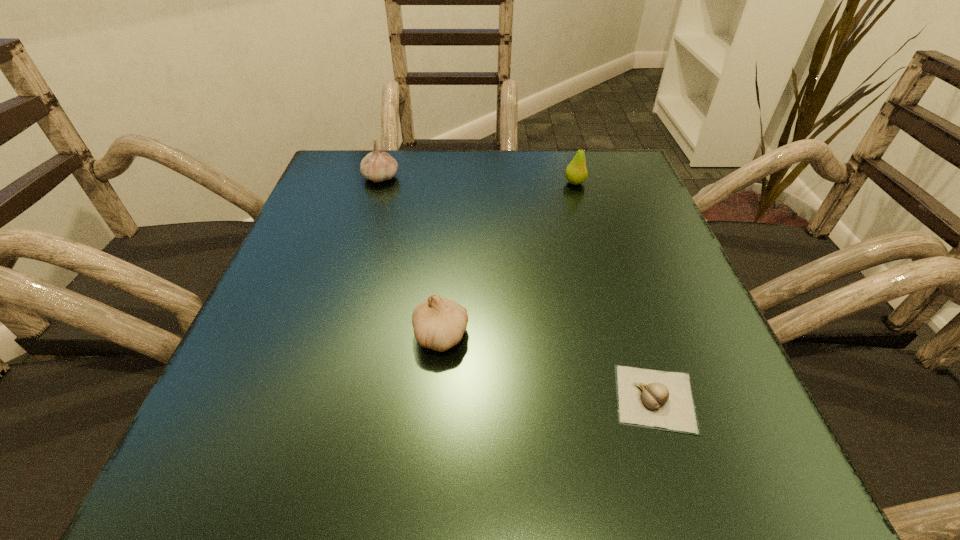
Locate an element on the screen. The image size is (960, 540). empty space that is in between the third tallest object and the leftmost garlic is located at coordinates (411, 256).

Where is `vacant space that's between the pear and the third tallest object`? The image size is (960, 540). vacant space that's between the pear and the third tallest object is located at coordinates (508, 259).

Identify the location of blank region between the pear and the farthest garlic. (478, 180).

Where is `vacant space that is in between the tallest garlic and the pear`? Image resolution: width=960 pixels, height=540 pixels. vacant space that is in between the tallest garlic and the pear is located at coordinates (478, 180).

You are a GUI agent. You are given a task and a screenshot of the screen. Output one action in this format:
    pyautogui.click(x=<x>, y=<y>)
    Task: Click on the vacant point located between the second nearest garlic and the pear
    This screenshot has height=540, width=960.
    Given the screenshot: What is the action you would take?
    pyautogui.click(x=508, y=259)

Where is `vacant space that's between the tallest garlic and the pear`? vacant space that's between the tallest garlic and the pear is located at coordinates (478, 180).

Locate an element on the screen. The height and width of the screenshot is (540, 960). object that is the third closest to the farthest garlic is located at coordinates (663, 400).

Select which object is the second closest to the nearest object. Please provide its 2D coordinates. Your answer should be formatted as a tuple, i.e. [(x, y)], where the tuple contains the x and y coordinates of a point satisfying the conditions above.

[(576, 172)]

Choose which garlic is the third nearest neighbor to the pear. Please provide its 2D coordinates. Your answer should be formatted as a tuple, i.e. [(x, y)], where the tuple contains the x and y coordinates of a point satisfying the conditions above.

[(663, 400)]

Select which garlic is the second closest to the pear. Please provide its 2D coordinates. Your answer should be formatted as a tuple, i.e. [(x, y)], where the tuple contains the x and y coordinates of a point satisfying the conditions above.

[(438, 323)]